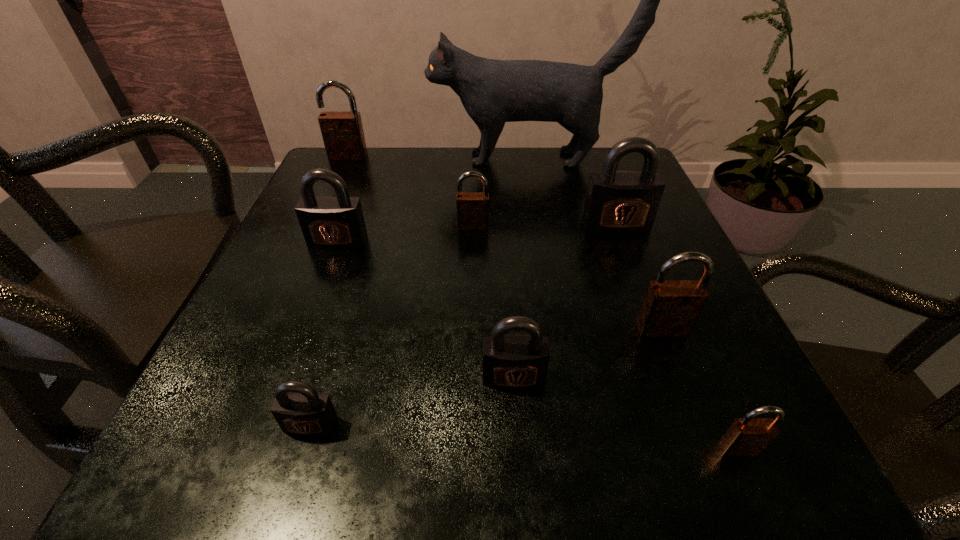
The image size is (960, 540). In order to click on object positioned at the near right corner in this screenshot , I will do `click(748, 436)`.

This screenshot has width=960, height=540. What are the coordinates of `free space at the far edge of the desktop` in the screenshot? It's located at (546, 149).

The width and height of the screenshot is (960, 540). What are the coordinates of `vacant area at the near edge` in the screenshot? It's located at tap(571, 420).

In the image, there is a desktop. Identify the location of vacant area at the right edge. This screenshot has width=960, height=540. (710, 375).

Image resolution: width=960 pixels, height=540 pixels. What are the coordinates of `vacant area at the far left corner of the desktop` in the screenshot? It's located at (381, 184).

Identify the location of free region at the near left corner of the desktop. Image resolution: width=960 pixels, height=540 pixels. (273, 469).

Where is `free space at the far right corner of the desktop`? This screenshot has height=540, width=960. free space at the far right corner of the desktop is located at coordinates (623, 166).

Where is `unoccupied area between the tallest object and the nearest gray padlock`? The height and width of the screenshot is (540, 960). unoccupied area between the tallest object and the nearest gray padlock is located at coordinates (420, 292).

Locate an element on the screen. unoccupied position between the nearest gray padlock and the gray cat is located at coordinates (420, 292).

You are a GUI agent. You are given a task and a screenshot of the screen. Output one action in this format:
    pyautogui.click(x=<x>, y=<y>)
    Task: Click on the empty space between the biggest gray padlock and the second biggest brown padlock
    Image resolution: width=960 pixels, height=540 pixels.
    Given the screenshot: What is the action you would take?
    (639, 276)